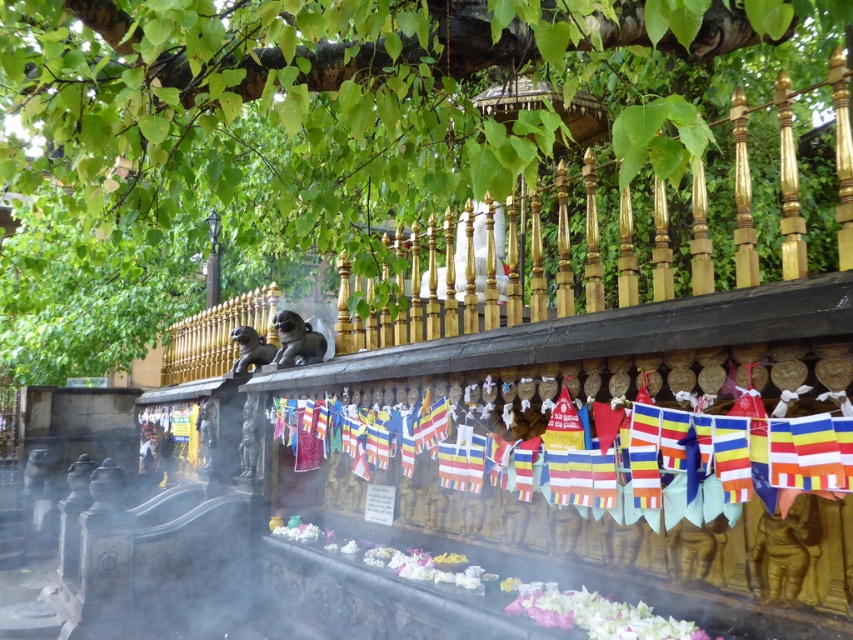
This screenshot has width=853, height=640. Describe the element at coordinates (399, 163) in the screenshot. I see `green leafy tree at upper center` at that location.

Between green leafy tree at upper center and multi-colored fabric flags at center, which one has more height?

green leafy tree at upper center is taller.

Which is in front, point (809, 241) or point (283, 435)?

Point (809, 241) is more forward.

The image size is (853, 640). I want to click on green leafy tree at upper center, so [399, 163].